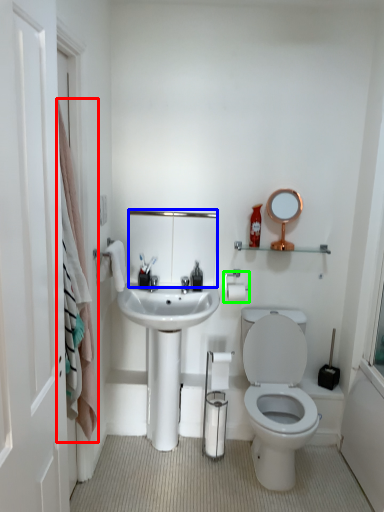
Question: Which object is positioned closest to shower curtain (highlighted by a red box)? Select from mirror (highlighted by a blue box) and towel bar (highlighted by a green box).

Choices:
 (A) mirror
 (B) towel bar

Answer: (A)